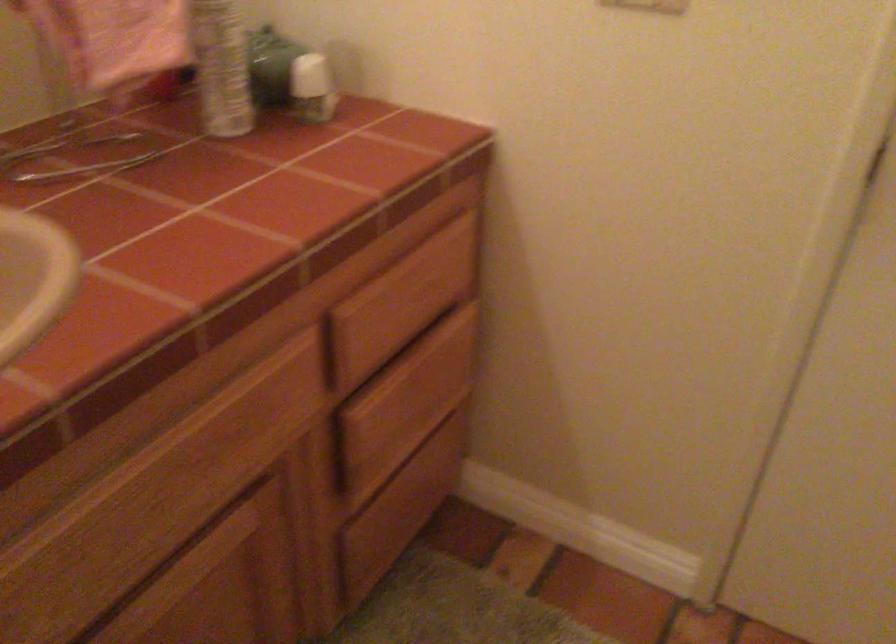
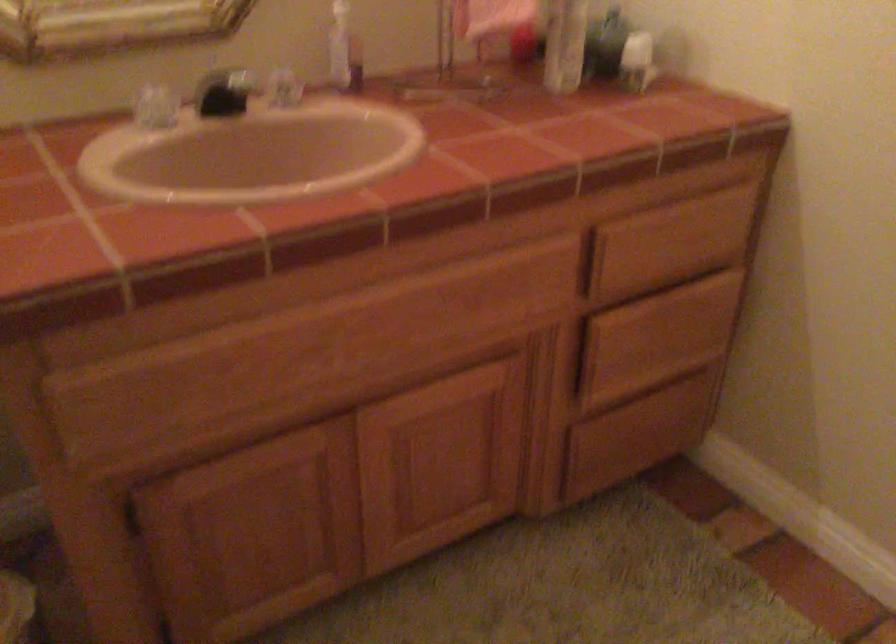
The point at (x=416, y=404) is marked in the first image. Where is the corresponding point in the second image?

(657, 337)